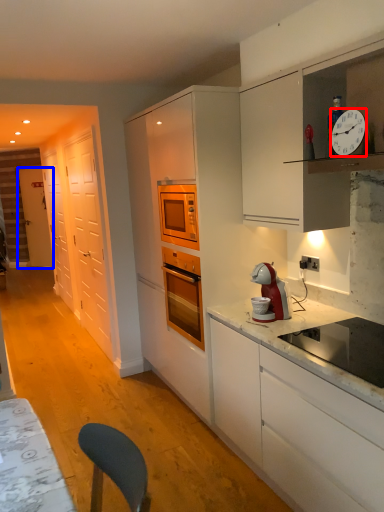
Question: Which of the following is the farthest to the observer, clock (highlighted by a red box) or door (highlighted by a blue box)?

Choices:
 (A) clock
 (B) door

Answer: (B)